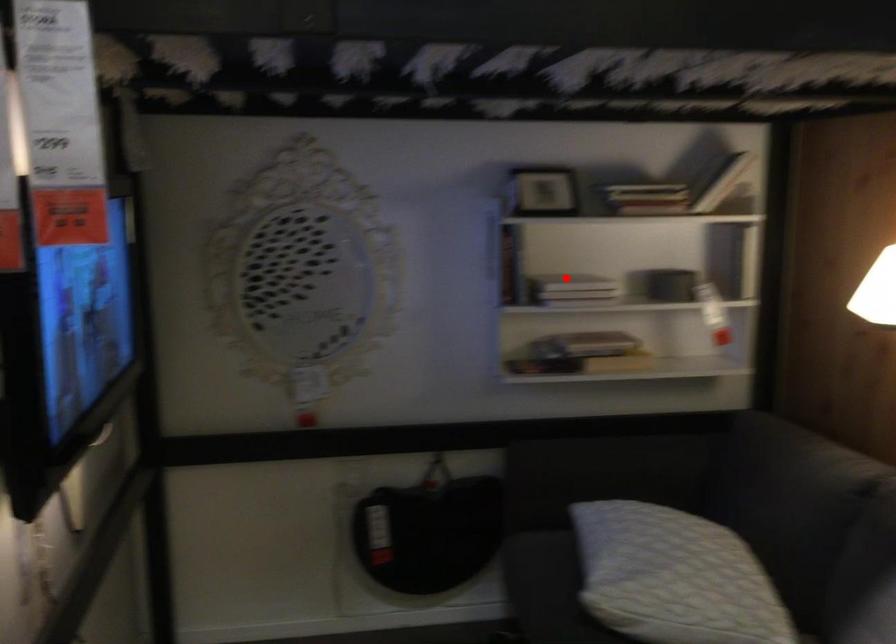
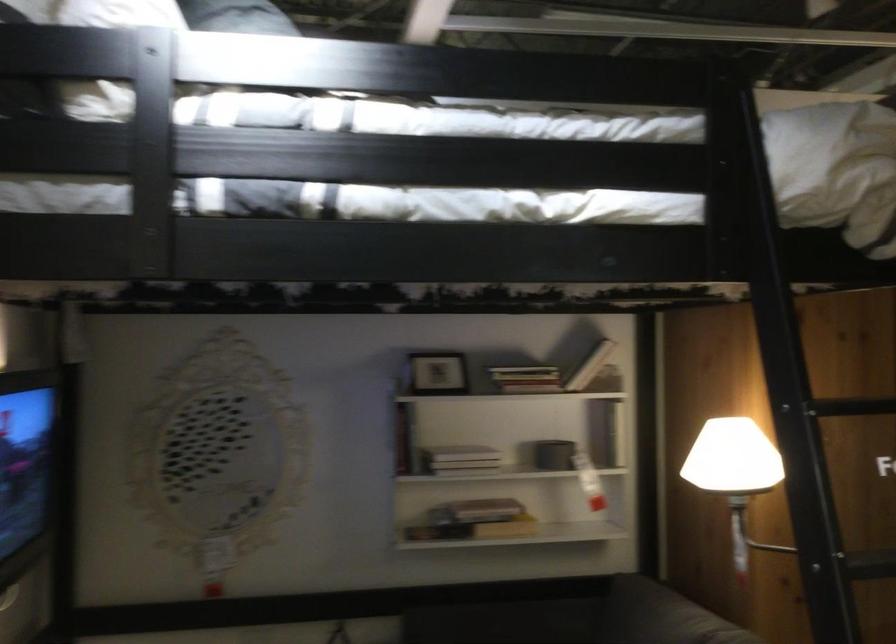
Question: A red point is marked in image1. In image2, is the corresponding 3D point closer to the camera or farther? Reply with the corresponding letter.

Choices:
 (A) The corresponding 3D point is closer.
 (B) The corresponding 3D point is farther.

Answer: (B)